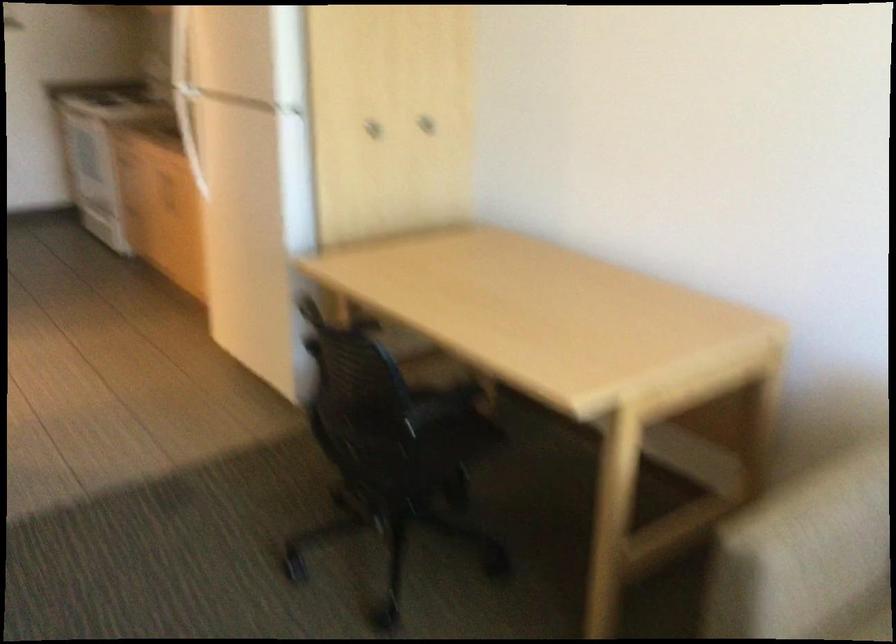
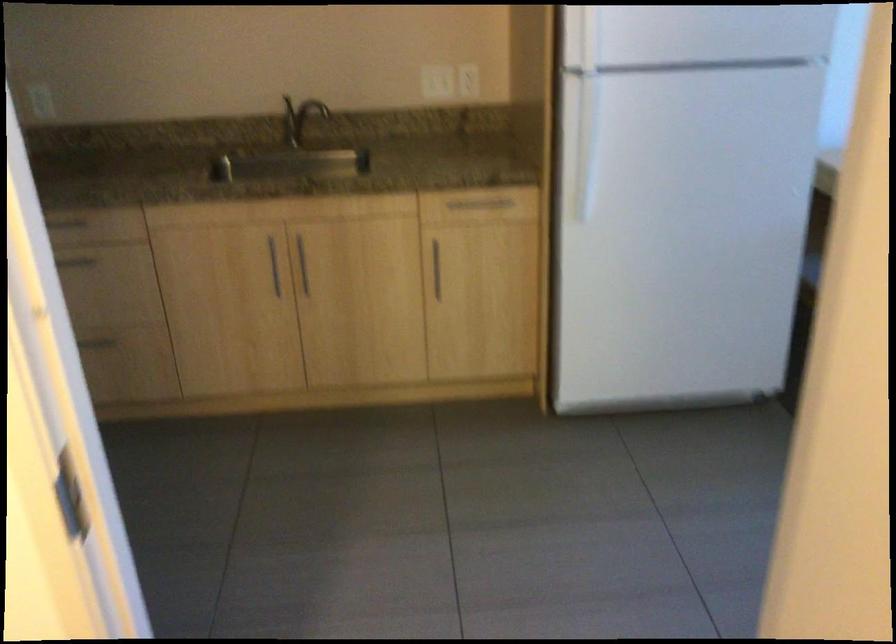
Question: I am providing you with two images of the same scene from different viewpoints. After the viewpoint changes to image2, which objects are now occluded?

Choices:
 (A) small toy figure
 (B) metal cabinet handle
 (C) wall outlet
 (D) cabinet door knob

Answer: (D)